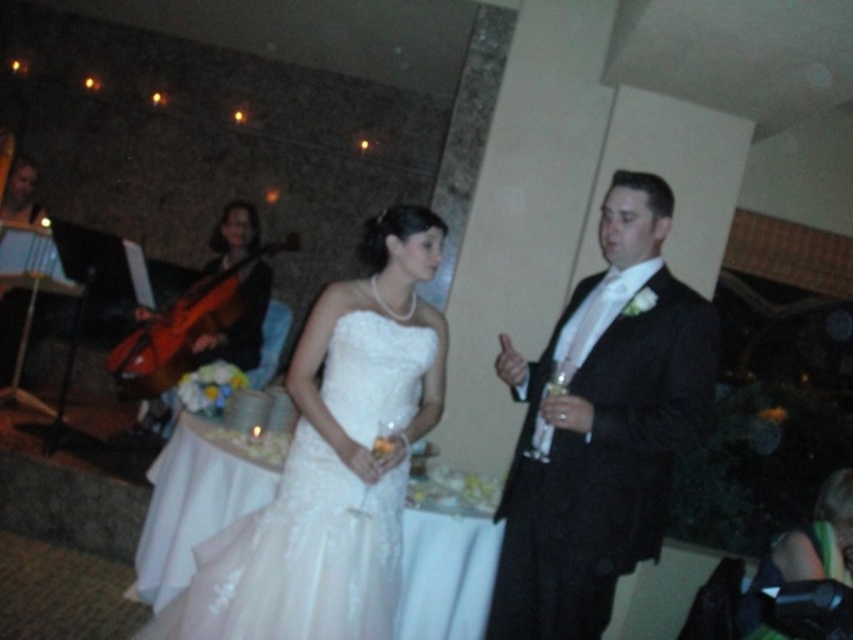
How far apart are black satin tuxedo at right and matte brown cello at left?

They are 7.86 feet apart.

Can you confirm if black satin tuxedo at right is thinner than matte brown cello at left?

In fact, black satin tuxedo at right might be wider than matte brown cello at left.

Does point (584, 323) come farther from viewer compared to point (257, 308)?

No, (584, 323) is closer to viewer.

The width and height of the screenshot is (853, 640). I want to click on black satin tuxedo at right, so click(601, 426).

Is black satin tuxedo at right positioned before white lace dress at center?

Yes.

Is point (547, 426) closer to viewer compared to point (222, 536)?

That is True.

You are a GUI agent. You are given a task and a screenshot of the screen. Output one action in this format:
    pyautogui.click(x=<x>, y=<y>)
    Task: Click on the black satin tuxedo at right
    
    Given the screenshot: What is the action you would take?
    pyautogui.click(x=601, y=426)

Does point (636, 364) lie in front of point (579, 416)?

No, it is not.

Measure the distance between black satin tuxedo at right and camera.

They are 2.16 meters apart.

Locate an element on the screen. Image resolution: width=853 pixels, height=640 pixels. black satin tuxedo at right is located at coordinates (601, 426).